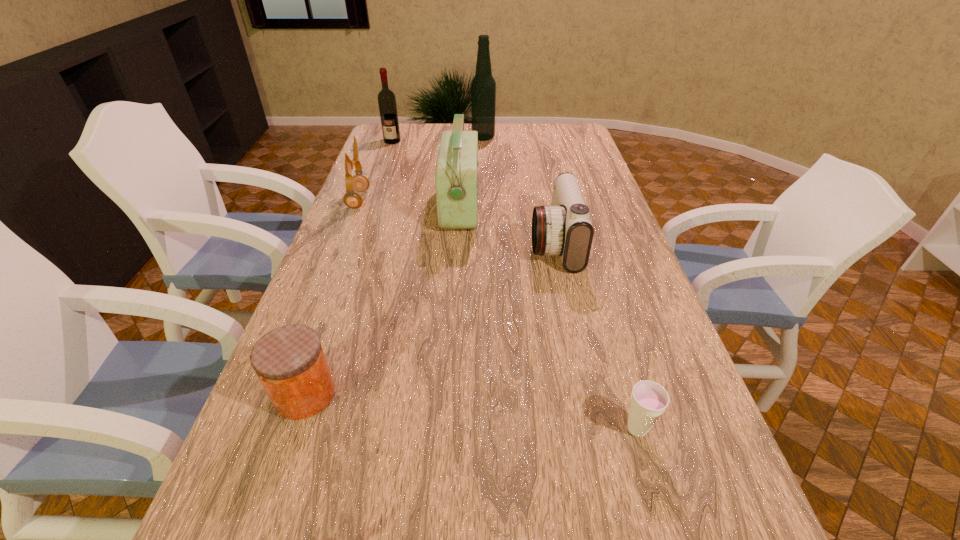
I want to click on the right alcohol, so click(x=483, y=86).

Locate an element on the screen. Image resolution: width=960 pixels, height=540 pixels. the taller alcohol is located at coordinates (483, 86).

Locate an element on the screen. Image resolution: width=960 pixels, height=540 pixels. the left alcohol is located at coordinates point(386,98).

Find the location of `radio receiver`. radio receiver is located at coordinates (456, 175).

You are a GUI agent. You are given a task and a screenshot of the screen. Output one action in this format:
    pyautogui.click(x=<x>, y=<y>)
    Task: Click on the earphone
    This screenshot has height=540, width=960.
    Given the screenshot: What is the action you would take?
    pyautogui.click(x=352, y=199)

The width and height of the screenshot is (960, 540). In order to click on camcorder in this screenshot , I will do `click(564, 228)`.

In order to click on the sixth tallest object in this screenshot , I will do `click(289, 361)`.

I want to click on cup, so click(x=649, y=399).

Locate an element on the screen. This screenshot has height=540, width=960. vacant position located on the right of the tallest object is located at coordinates (587, 138).

At what (x,y) coordinates should I click in order to perform the action: click on free space located 0.240m on the front and back of the shorter alcohol. Please return your answer as a coordinate pair (x, y). The height and width of the screenshot is (540, 960). Looking at the image, I should click on (381, 172).